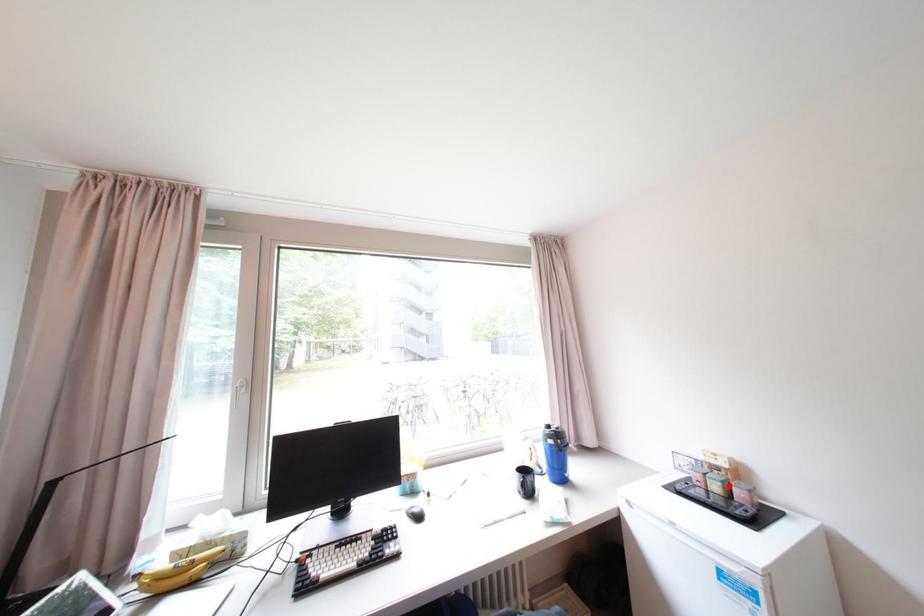
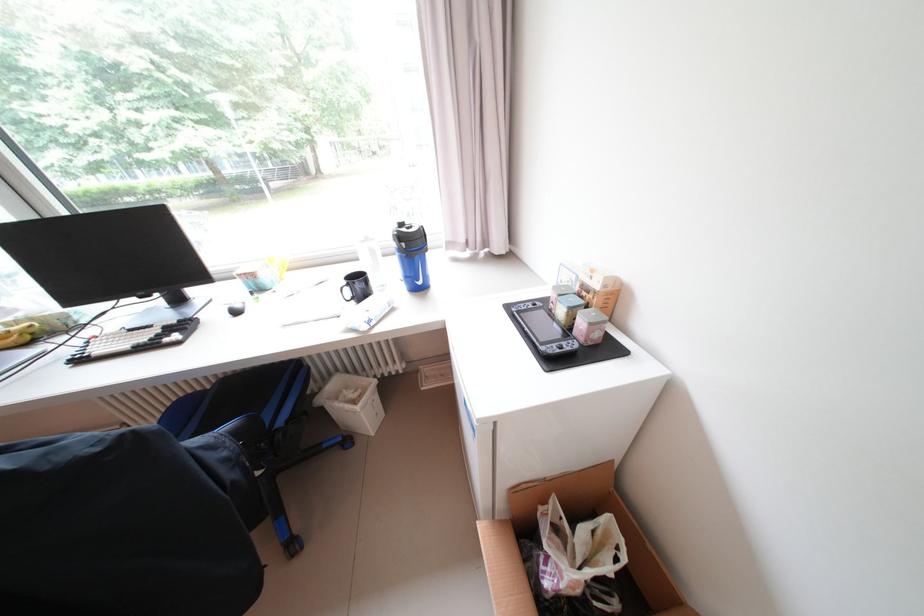
The point at the highlighted location is marked in the first image. Where is the corresponding point in the second image?

(574, 310)